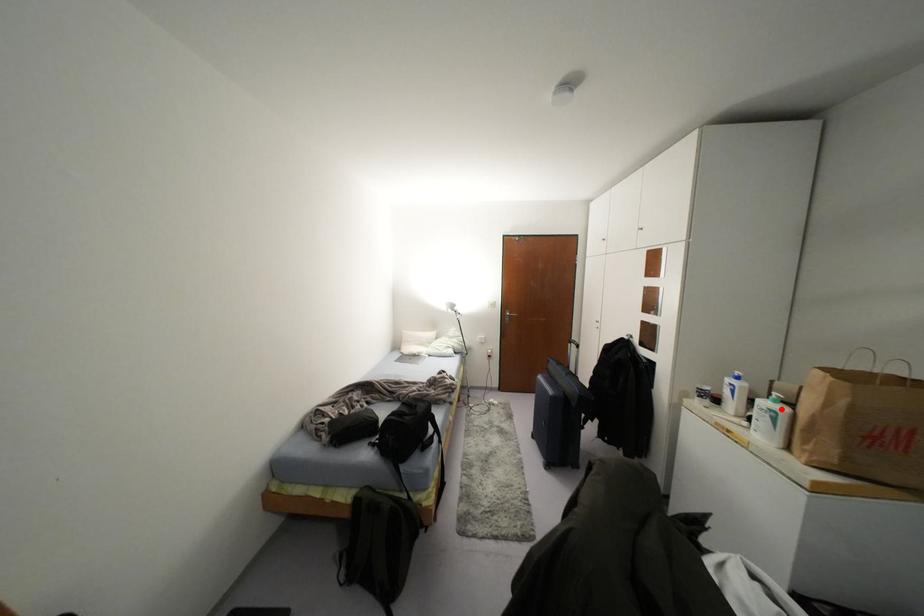
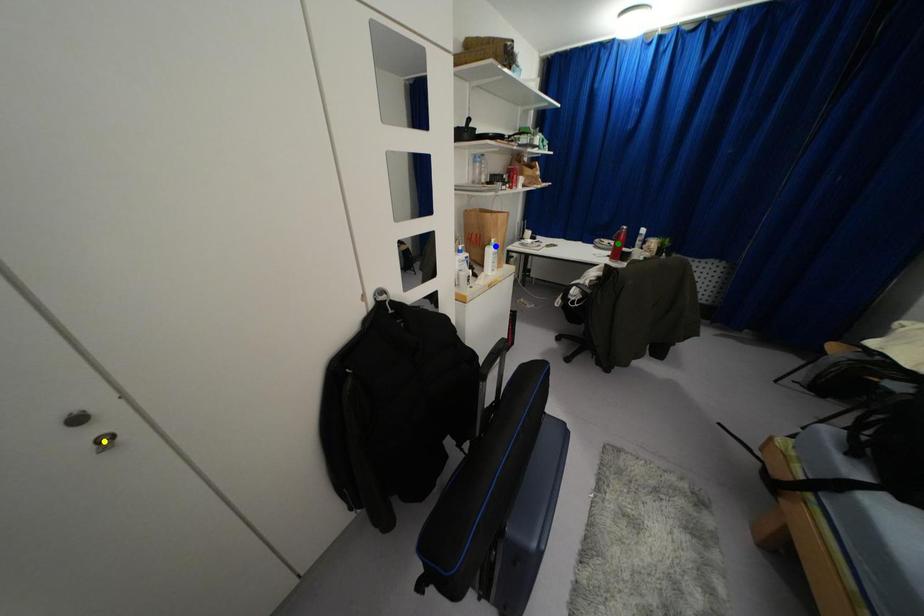
Question: I am providing you with two images of the same scene from different viewpoints. A red point is marked on the first image. You are given multiple points on the second image. Which spot in image 2 lines up with the point in image 1?

Choices:
 (A) blue point
 (B) green point
 (C) yellow point

Answer: (A)